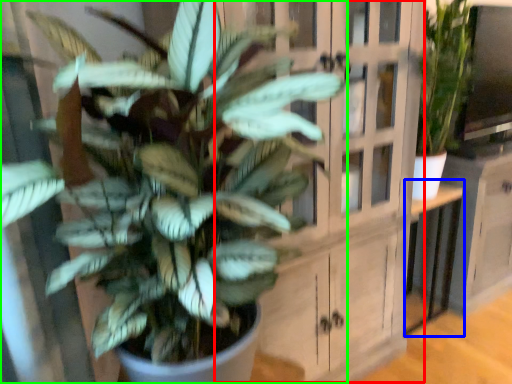
Question: Which object is the closest to the dresser (highlighted by a red box)? Choose among these: table (highlighted by a blue box) or houseplant (highlighted by a green box).

Choices:
 (A) table
 (B) houseplant

Answer: (B)